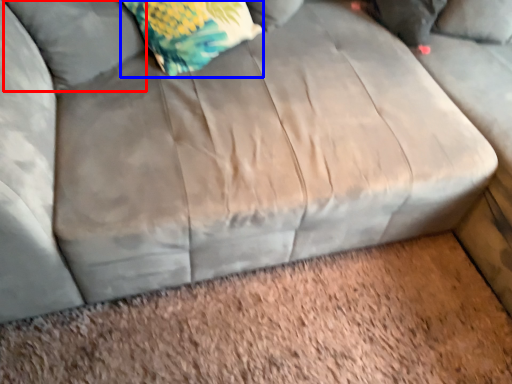
Question: Which object is further to the camera taking this photo, pillow (highlighted by a red box) or throw pillow (highlighted by a blue box)?

Choices:
 (A) pillow
 (B) throw pillow

Answer: (B)